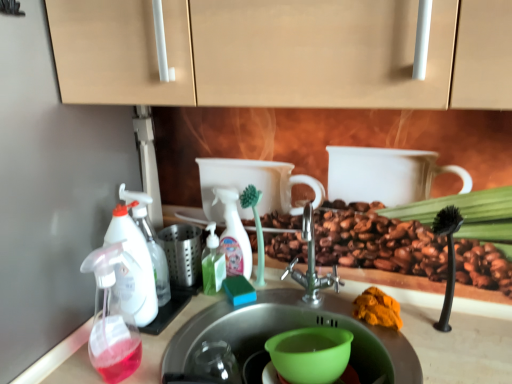
Where is `free space on the front side of orange powder at sink`? free space on the front side of orange powder at sink is located at coordinates (393, 347).